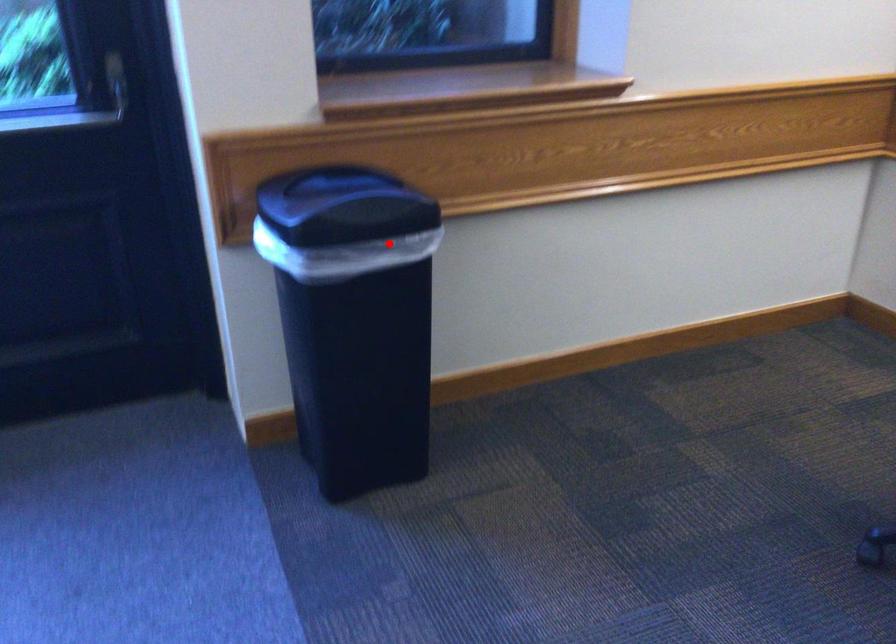
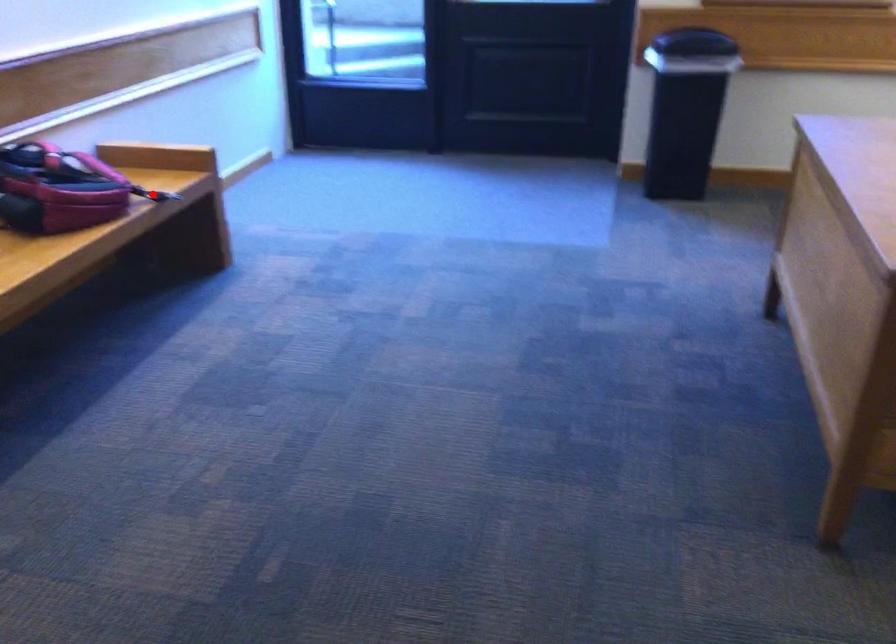
I am providing you with two images of the same scene from different viewpoints. A red point is marked on the first image and another point is marked on the second image. Does the point marked in image1 correspond to the same location as the one in image2?

No